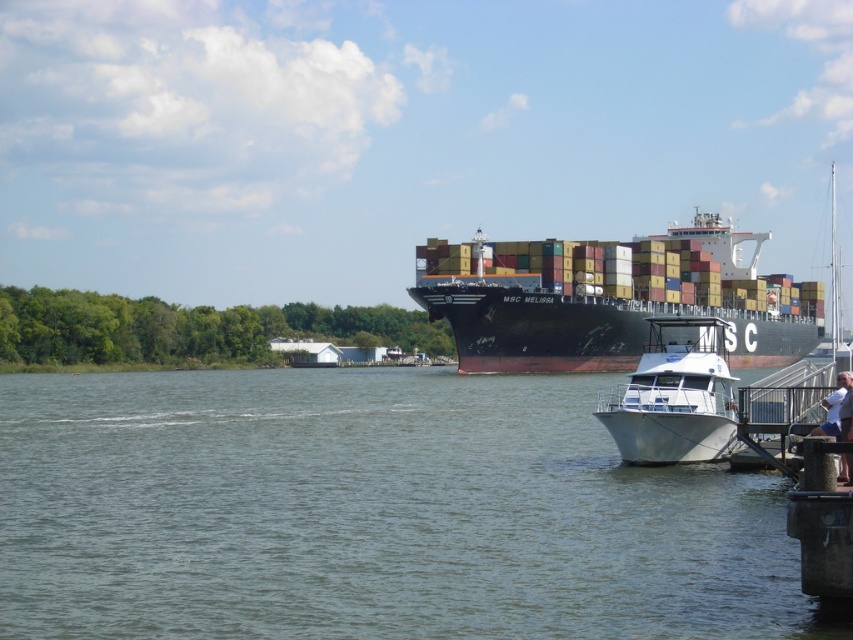
Can you confirm if greenish water at lower left is shorter than black matte container ship at center?

Yes, greenish water at lower left is shorter than black matte container ship at center.

Does greenish water at lower left appear under black matte container ship at center?

Yes, greenish water at lower left is below black matte container ship at center.

The width and height of the screenshot is (853, 640). What do you see at coordinates (372, 513) in the screenshot?
I see `greenish water at lower left` at bounding box center [372, 513].

Where is `greenish water at lower left`? The width and height of the screenshot is (853, 640). greenish water at lower left is located at coordinates (372, 513).

Between black matte container ship at center and white glossy boat at lower right, which one has more height?

black matte container ship at center

Is point (462, 349) behind point (701, 429)?

Yes, it is.

Between point (807, 298) and point (695, 397), which one is positioned in front?

Point (695, 397) is more forward.

What are the coordinates of `black matte container ship at center` in the screenshot? It's located at (614, 300).

Can you confirm if greenish water at lower left is positioned to the left of white glossy boat at lower right?

Yes, greenish water at lower left is to the left of white glossy boat at lower right.

Between greenish water at lower left and white glossy boat at lower right, which one has more height?

Standing taller between the two is white glossy boat at lower right.

Who is more forward, (108, 573) or (646, 378)?

Point (108, 573) is more forward.

The image size is (853, 640). I want to click on greenish water at lower left, so click(x=372, y=513).